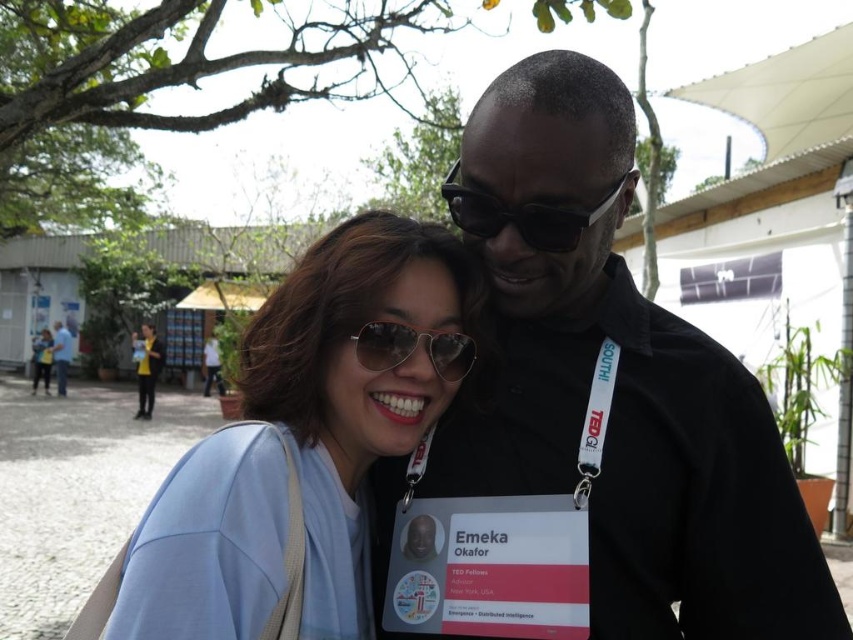
You are a photographer at an event and need to capture a clear photo of the metallic reflective goggles at center without the black matte shirt at upper right appearing in the frame. Can you adjust your angle to achieve this?

The black matte shirt at upper right is positioned on the right side of the metallic reflective goggles at center. By shifting the camera angle slightly to the left, you can frame the metallic reflective goggles at center while excluding the black matte shirt at upper right from the shot.

You are standing at the origin point in the image and want to take a photo of both the point at (x=657, y=499) and the point at (x=465, y=346). Which point should you focus on first to ensure both are in focus?

You should focus on the point at (x=465, y=346) first because it is closer to you than the point at (x=657, y=499), ensuring both will be in focus when using depth of field.